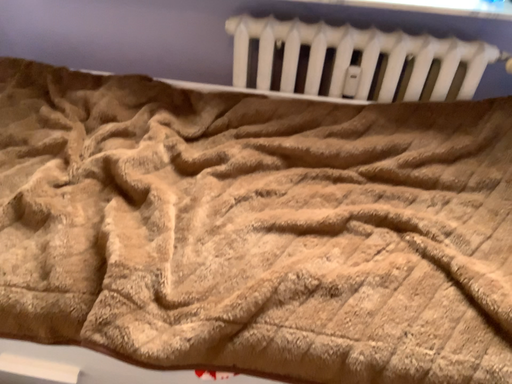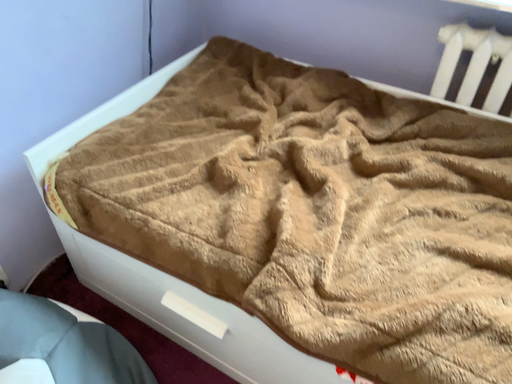
Question: Which way did the camera rotate in the video?

Choices:
 (A) rotated right
 (B) rotated left

Answer: (B)